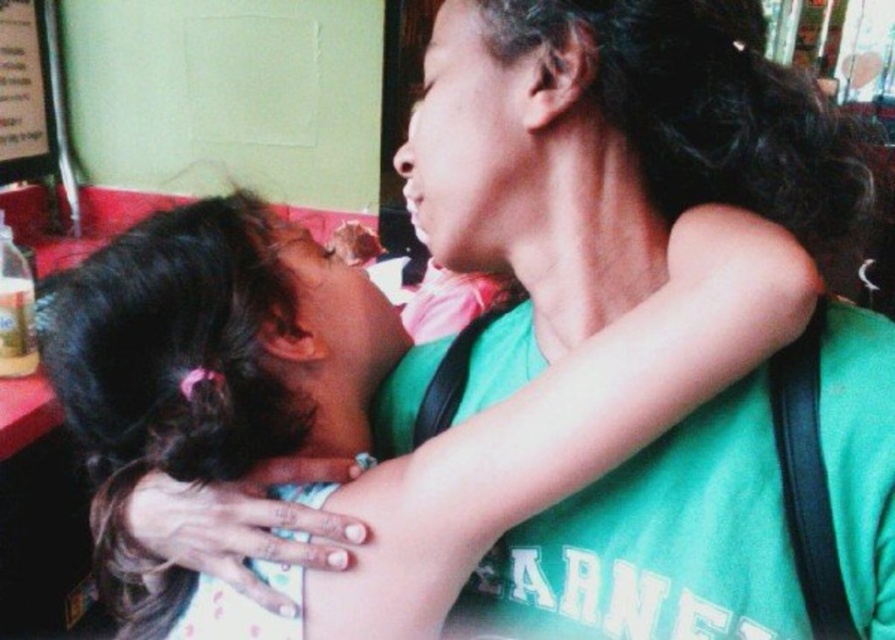
Is point (401, 502) behind point (28, 28)?

No, (401, 502) is in front of (28, 28).

The image size is (895, 640). What do you see at coordinates (211, 348) in the screenshot?
I see `dark brown hair at upper left` at bounding box center [211, 348].

Where is `dark brown hair at upper left`? The image size is (895, 640). dark brown hair at upper left is located at coordinates (211, 348).